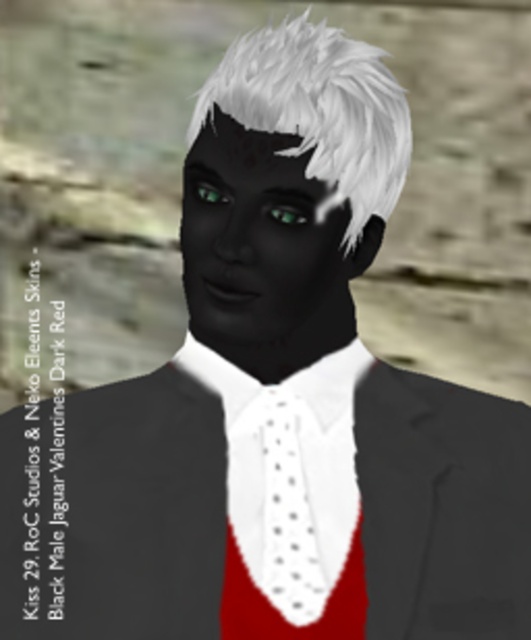
Between point (267, 538) and point (277, 209), which one is positioned in front?

Point (277, 209)

Does white dotted fabric tie at center have a greater width compared to green iridescent eye at center?

Correct, the width of white dotted fabric tie at center exceeds that of green iridescent eye at center.

Between point (292, 397) and point (282, 209), which one is positioned in front?

Point (282, 209) is more forward.

You are a GUI agent. You are given a task and a screenshot of the screen. Output one action in this format:
    pyautogui.click(x=<x>, y=<y>)
    Task: Click on the white dotted fabric tie at center
    
    Given the screenshot: What is the action you would take?
    [285, 509]

Does point (304, 218) come in front of point (229, 198)?

No.

Measure the distance between green iridescent eye at center and green glossy eye at center.

The distance of green iridescent eye at center from green glossy eye at center is 1.49 inches.

Is point (304, 214) positioned in front of point (215, 192)?

Yes.

Locate an element on the screen. The width and height of the screenshot is (531, 640). green iridescent eye at center is located at coordinates (286, 212).

How distant is white matte hair at upper center from green iridescent eye at center?

A distance of 10.73 centimeters exists between white matte hair at upper center and green iridescent eye at center.

Does white matte hair at upper center appear on the right side of green iridescent eye at center?

Yes, white matte hair at upper center is to the right of green iridescent eye at center.

Locate an element on the screen. Image resolution: width=531 pixels, height=640 pixels. white matte hair at upper center is located at coordinates (319, 112).

Identify the location of white matte hair at upper center. (319, 112).